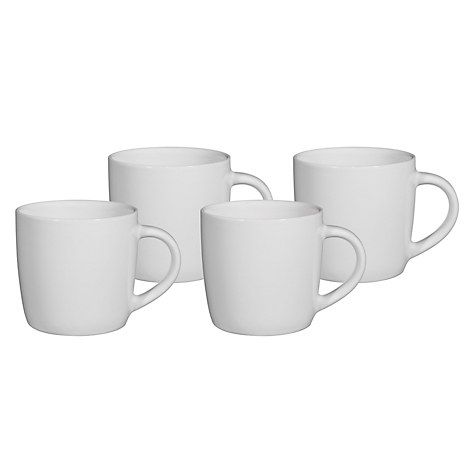
Locate an element on the screen. This screenshot has height=475, width=475. cup handles is located at coordinates (166, 237), (255, 181), (350, 239), (430, 237).